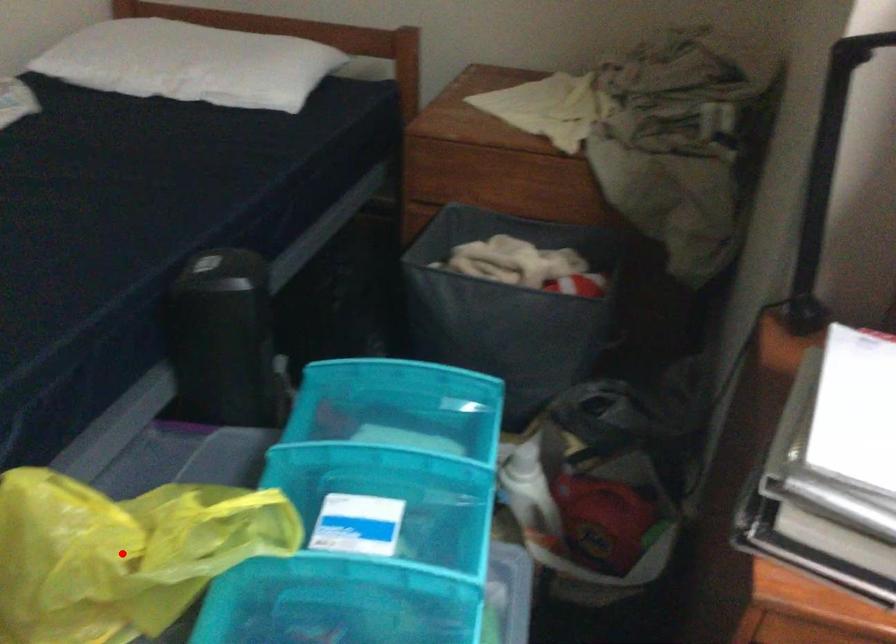
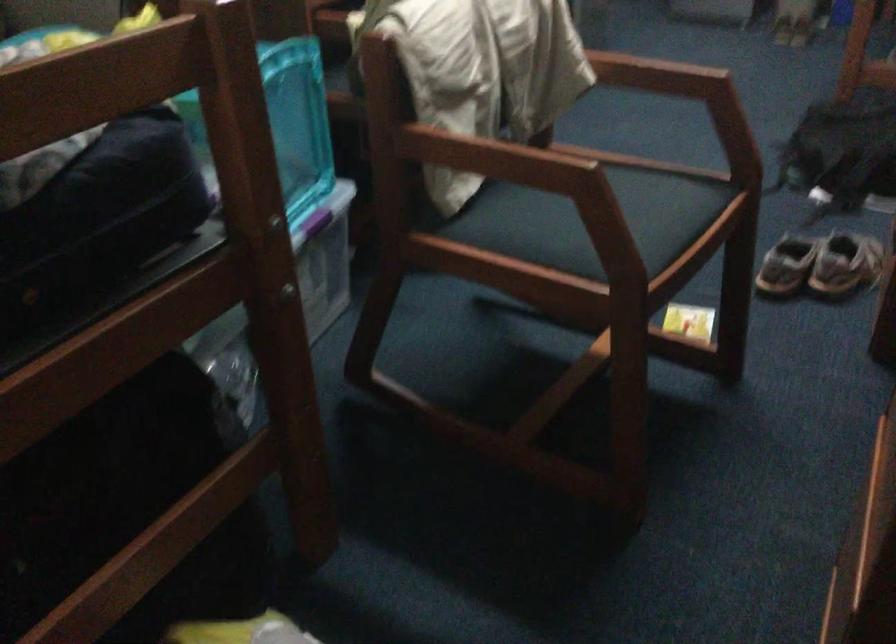
Question: I am providing you with two images of the same scene from different viewpoints. A red point is marked on the first image. Is the red point's position out of view in image 2?

Choices:
 (A) Yes
 (B) No

Answer: (A)